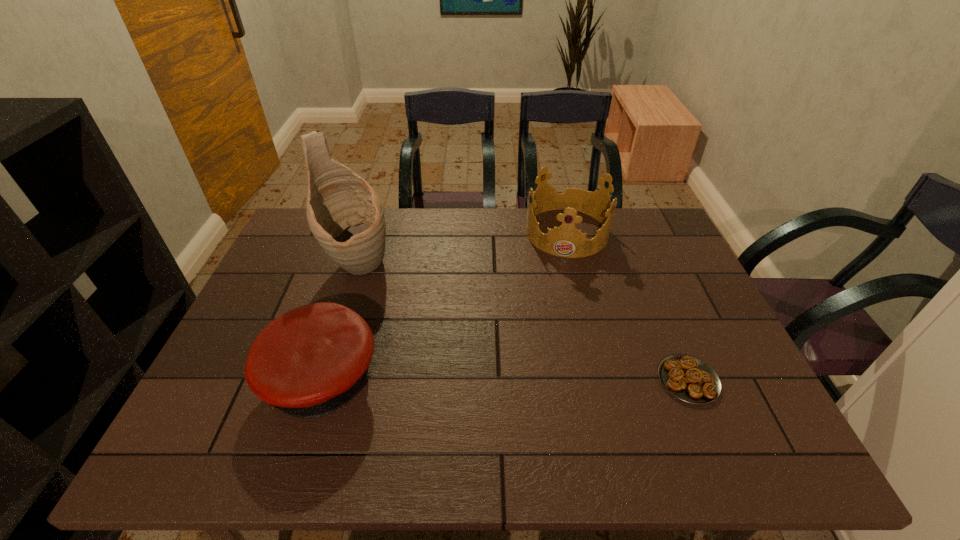
Identify the location of free space located 0.150m at the spout of the pitcher. The image size is (960, 540). (404, 313).

You are a GUI agent. You are given a task and a screenshot of the screen. Output one action in this format:
    pyautogui.click(x=<x>, y=<y>)
    Task: Click on the vacant space positioned 0.300m on the front-facing side of the tiara
    The width and height of the screenshot is (960, 540).
    Given the screenshot: What is the action you would take?
    pyautogui.click(x=555, y=329)

I want to click on vacant region located 0.100m on the front-facing side of the tiara, so click(x=562, y=279).

Find the location of a particular element. This screenshot has width=960, height=540. vacant space positioned on the front-facing side of the tiara is located at coordinates (559, 300).

The image size is (960, 540). I want to click on pitcher that is at the far edge, so click(346, 216).

Find the location of `tiara that is positioned at the far edge`. tiara that is positioned at the far edge is located at coordinates (567, 241).

You are a GUI agent. You are given a task and a screenshot of the screen. Output one action in this format:
    pyautogui.click(x=<x>, y=<y>)
    Task: Click on the cap located in the near edge section of the desktop
    The height and width of the screenshot is (540, 960).
    Given the screenshot: What is the action you would take?
    pyautogui.click(x=309, y=362)

The width and height of the screenshot is (960, 540). Identify the location of pastry that is at the near edge. (688, 378).

The width and height of the screenshot is (960, 540). I want to click on cap at the left edge, so click(x=309, y=362).

Locate an element on the screen. pitcher present at the left edge is located at coordinates (346, 216).